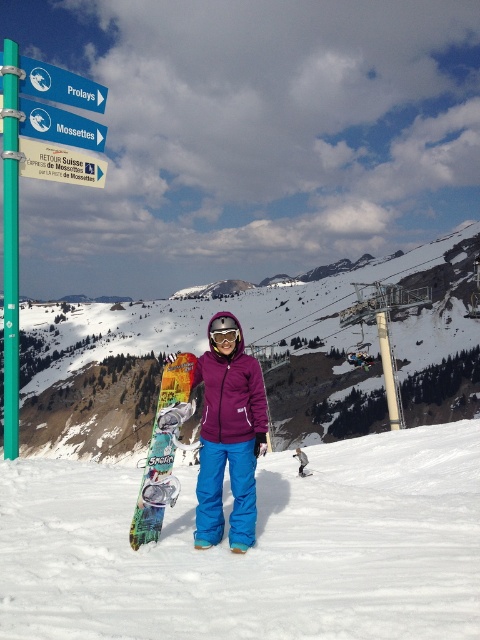
Question: Which of the following is the closest to the observer?

Choices:
 (A) white snowboard at center
 (B) blue plastic sign at upper left
 (C) transparent orange goggles at center
 (D) white plastic sign at upper left

Answer: (C)

Question: Is teal glossy pole at left further to the viewer compared to matte purple jacket at center?

Choices:
 (A) no
 (B) yes

Answer: (A)

Question: Which point is closer to the camera?

Choices:
 (A) (26, 120)
 (B) (300, 458)
 (C) (12, 413)

Answer: (A)

Question: Which of the following is the closest to the observer?

Choices:
 (A) (36, 102)
 (B) (297, 563)
 (C) (48, 164)
 (D) (170, 442)

Answer: (B)

Question: Is teal glossy pole at left positioned behind white plastic sign at upper left?

Choices:
 (A) yes
 (B) no

Answer: (B)

Question: Can you confirm if transparent orange goggles at center is thinner than matte purple jacket at center?

Choices:
 (A) no
 (B) yes

Answer: (B)